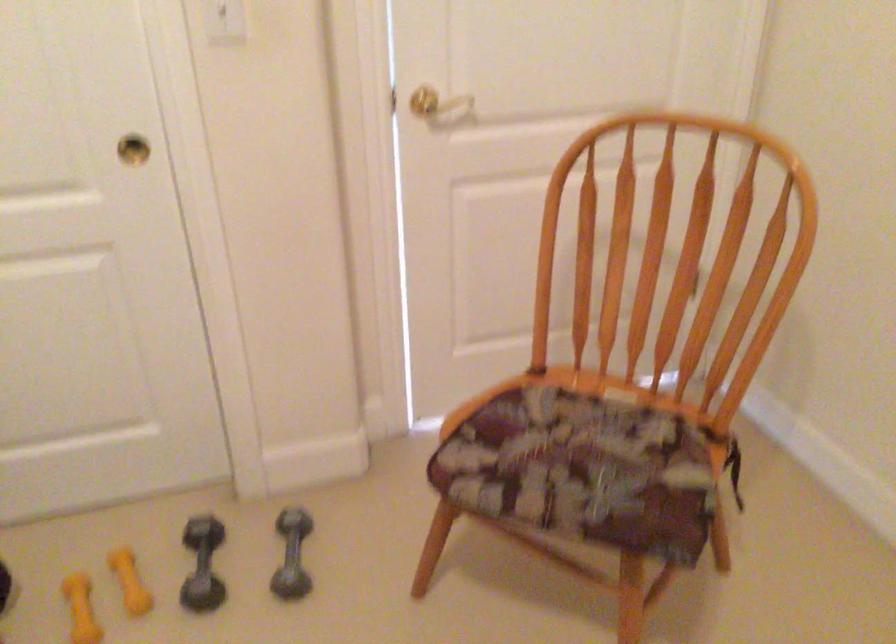
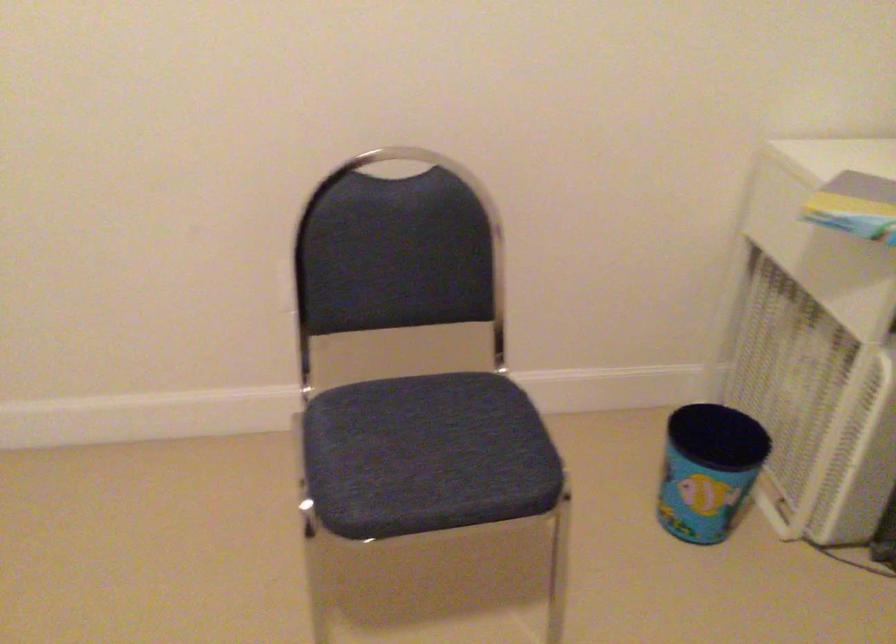
How did the camera likely rotate?

The camera's rotation is toward right-down.